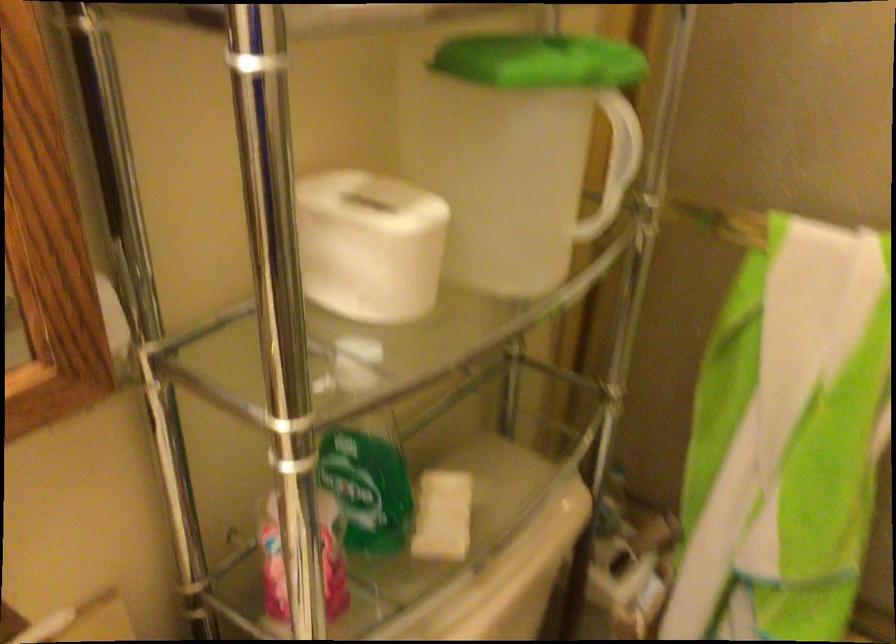
The width and height of the screenshot is (896, 644). What are the coordinates of `green plastic bottle` in the screenshot? It's located at (367, 489).